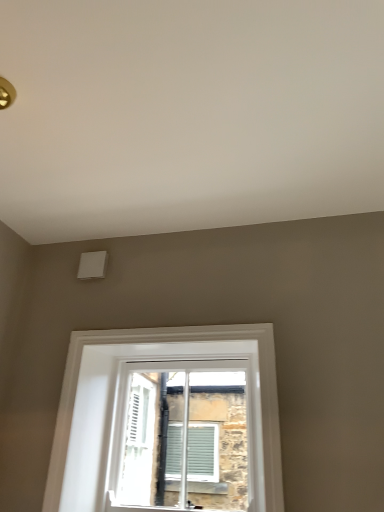
Question: Is point (67, 358) positioned closer to the camera than point (145, 390)?

Choices:
 (A) farther
 (B) closer

Answer: (B)

Question: From a real-world perspective, is white plastic window at center, positioned as the 1th window in front-to-back order, physically located above or below white glass window at center, the 2th window from the front?

Choices:
 (A) above
 (B) below

Answer: (A)

Question: Is white plastic window at center, positioned as the 1th window in front-to-back order, in front of or behind white glass window at center, the 2th window from the front, in the image?

Choices:
 (A) behind
 (B) front

Answer: (B)

Question: Is white glass window at center, which is the 1th window in back-to-front order, wider or thinner than white plastic window at center, positioned as the 1th window in front-to-back order?

Choices:
 (A) wide
 (B) thin

Answer: (A)

Question: Considering the positions of white glass window at center, which is the 1th window in back-to-front order, and white plastic window at center, positioned as the 1th window in front-to-back order, in the image, is white glass window at center, which is the 1th window in back-to-front order, bigger or smaller than white plastic window at center, positioned as the 1th window in front-to-back order,?

Choices:
 (A) small
 (B) big

Answer: (B)

Question: From a real-world perspective, is white glass window at center, the 2th window from the front, physically located above or below white plastic window at center, positioned as the 1th window in front-to-back order?

Choices:
 (A) above
 (B) below

Answer: (B)

Question: Considering their positions, is white glass window at center, the 2th window from the front, located in front of or behind white plastic window at center, positioned as the 1th window in front-to-back order?

Choices:
 (A) front
 (B) behind

Answer: (B)